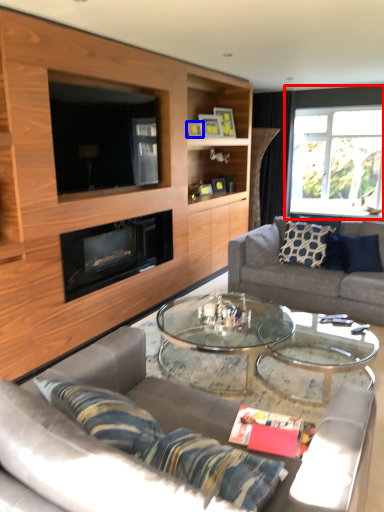
Question: Which point is closer to the camera, window (highlighted by a red box) or picture frame (highlighted by a blue box)?

Choices:
 (A) window
 (B) picture frame

Answer: (B)